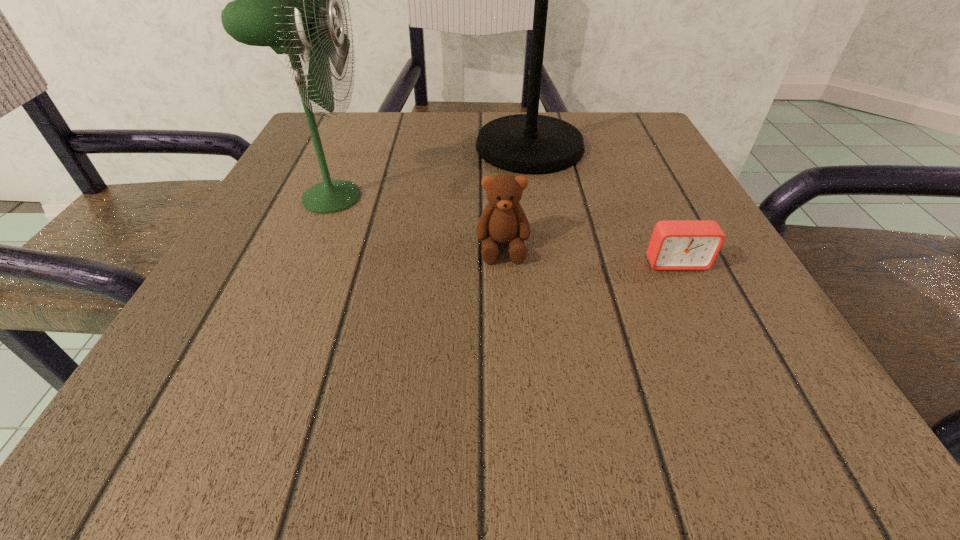
Where is `vacant region at the right edge of the desktop`? The image size is (960, 540). vacant region at the right edge of the desktop is located at coordinates (675, 204).

In the image, there is a desktop. Identify the location of vacant area at the near left corner. Image resolution: width=960 pixels, height=540 pixels. (178, 401).

At what (x,y) coordinates should I click in order to perform the action: click on vacant space at the far right corner of the desktop. Please return your answer as a coordinate pair (x, y). Looking at the image, I should click on click(572, 116).

Locate an element on the screen. Image resolution: width=960 pixels, height=540 pixels. empty space between the table lamp and the rightmost object is located at coordinates (603, 205).

What are the coordinates of `vacant region between the table lamp and the fan` in the screenshot? It's located at (430, 172).

Where is `free space between the tallest object and the leftmost object`? Image resolution: width=960 pixels, height=540 pixels. free space between the tallest object and the leftmost object is located at coordinates (430, 172).

Find the location of a particular element. The height and width of the screenshot is (540, 960). vacant space that is in between the alarm clock and the second shortest object is located at coordinates (589, 255).

I want to click on unoccupied position between the leftmost object and the tallest object, so click(430, 172).

Identify the location of free area in between the teddy bear and the shortest object. The height and width of the screenshot is (540, 960). (589, 255).

At what (x,y) coordinates should I click in order to perform the action: click on vacant region between the third shortest object and the table lamp. Please return your answer as a coordinate pair (x, y). Image resolution: width=960 pixels, height=540 pixels. Looking at the image, I should click on click(x=430, y=172).